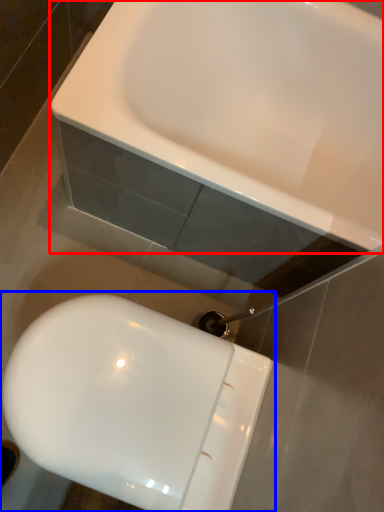
Question: Which object appears closest to the camera in this image, sink (highlighted by a red box) or toilet (highlighted by a blue box)?

Choices:
 (A) sink
 (B) toilet

Answer: (B)